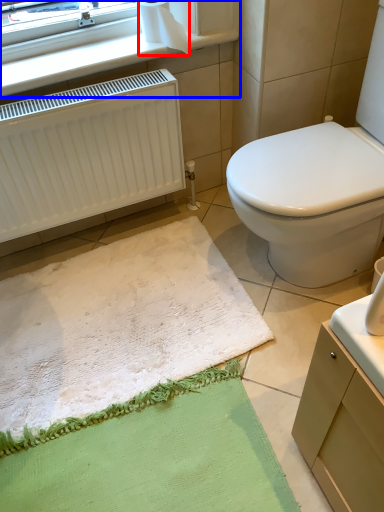
Question: Which object is further to the camera taking this photo, toilet paper (highlighted by a red box) or window frame (highlighted by a blue box)?

Choices:
 (A) toilet paper
 (B) window frame

Answer: (A)